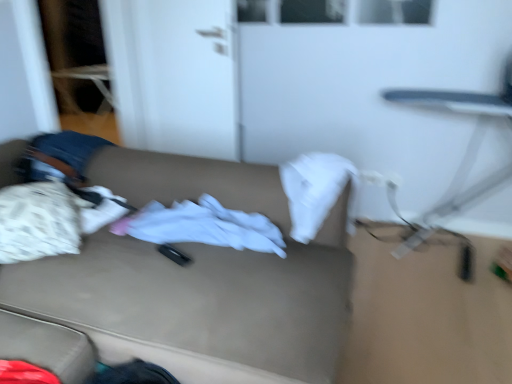
You are a GUI agent. You are given a task and a screenshot of the screen. Output one action in this format:
    pyautogui.click(x=<x>, y=<y>)
    Task: Click on the space that is in front of metallic silver swivel chair at right
    
    Given the screenshot: What is the action you would take?
    pyautogui.click(x=444, y=315)